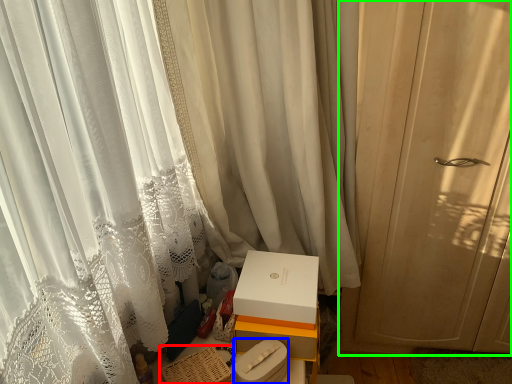
Question: Which object is the farthest from basket (highlighted by a red box)? Choose among these: box (highlighted by a blue box) or curtain (highlighted by a green box).

Choices:
 (A) box
 (B) curtain

Answer: (B)